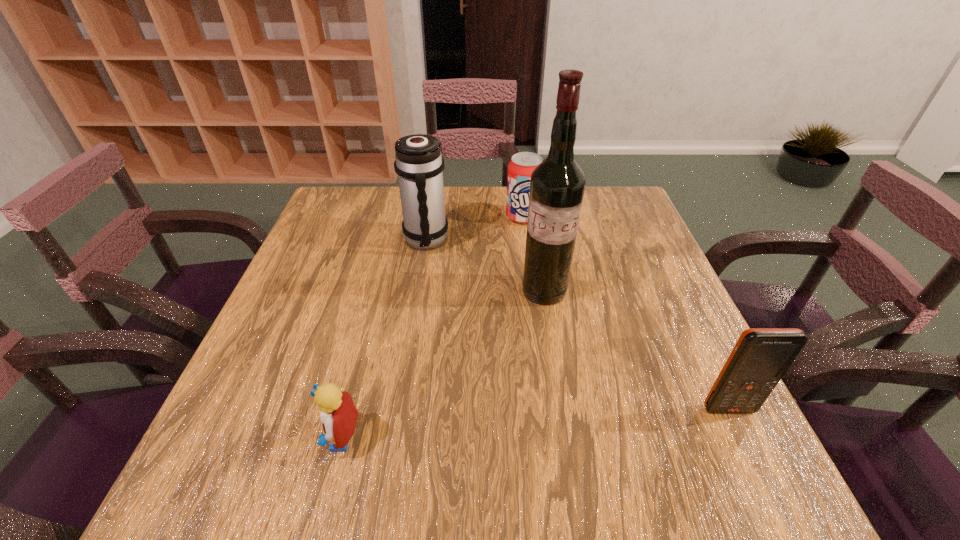
You are a GUI agent. You are given a task and a screenshot of the screen. Output one action in this format:
    pyautogui.click(x=<x>, y=<y>)
    Task: Click on the free region at the near left corner
    The width and height of the screenshot is (960, 540).
    Given the screenshot: What is the action you would take?
    271,423

Image resolution: width=960 pixels, height=540 pixels. What are the coordinates of `free space at the far right corner` in the screenshot? It's located at (599, 225).

Identify the location of free space between the thermos bottle and the wine bottle. This screenshot has height=540, width=960. (485, 266).

Where is `vacant area between the fourth shortest object and the soda can`? The height and width of the screenshot is (540, 960). vacant area between the fourth shortest object and the soda can is located at coordinates (x=474, y=229).

Identify the location of blank region between the nearest object and the thermos bottle. (383, 339).

This screenshot has width=960, height=540. I want to click on free space between the nearest object and the thermos bottle, so click(x=383, y=339).

Where is `empty location between the thermos bottle and the tallest object`? The width and height of the screenshot is (960, 540). empty location between the thermos bottle and the tallest object is located at coordinates (485, 266).

This screenshot has width=960, height=540. I want to click on vacant space in between the cellular telephone and the second shortest object, so click(626, 313).

Locate an element on the screen. empty space that is in between the second tallest object and the fourth tallest object is located at coordinates (474, 229).

Choose which object is the second nearest neighbor to the shortest object. Please provide its 2D coordinates. Your answer should be formatted as a tuple, i.e. [(x, y)], where the tuple contains the x and y coordinates of a point satisfying the conditions above.

[(419, 165)]